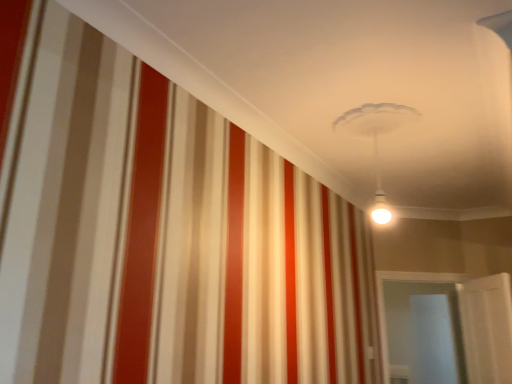
Question: Choose the correct answer: Is transparent glass door at lower right inside white glossy door at lower right or outside it?

Choices:
 (A) inside
 (B) outside

Answer: (B)

Question: In the image, is transparent glass door at lower right positioned in front of or behind white glossy door at lower right?

Choices:
 (A) behind
 (B) front

Answer: (A)

Question: From the image's perspective, is transparent glass door at lower right positioned above or below white glossy door at lower right?

Choices:
 (A) below
 (B) above

Answer: (A)

Question: Relative to transparent glass door at lower right, is white glossy door at lower right in front or behind?

Choices:
 (A) front
 (B) behind

Answer: (A)

Question: Does point (490, 357) appear closer or farther from the camera than point (453, 369)?

Choices:
 (A) farther
 (B) closer

Answer: (B)

Question: From the image's perspective, is white glossy door at lower right positioned above or below transparent glass door at lower right?

Choices:
 (A) above
 (B) below

Answer: (A)

Question: Considering the positions of white glossy door at lower right and transparent glass door at lower right in the image, is white glossy door at lower right bigger or smaller than transparent glass door at lower right?

Choices:
 (A) small
 (B) big

Answer: (A)